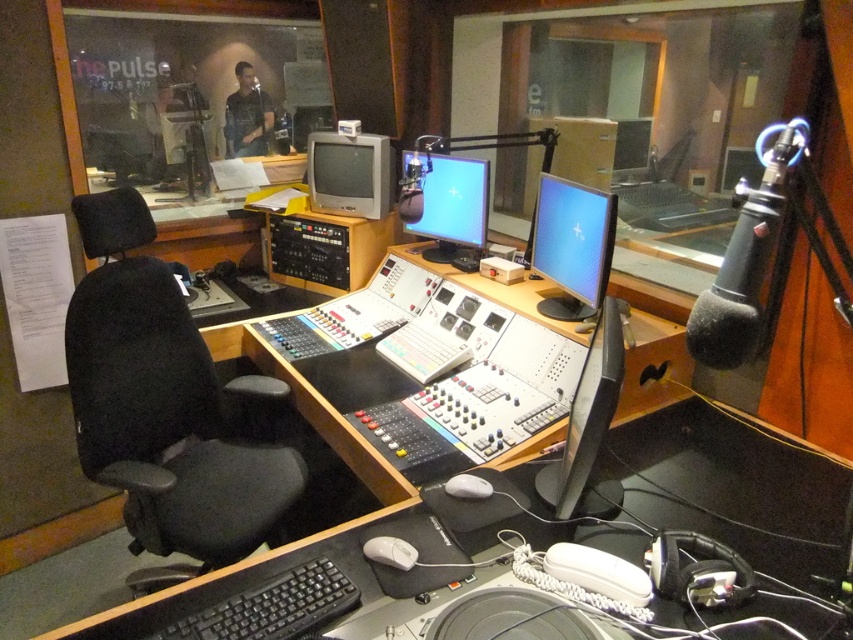
Who is more forward, (142, 433) or (303, 630)?

Positioned in front is point (303, 630).

Locate an element on the screen. Image resolution: width=853 pixels, height=640 pixels. black fabric swivel chair at left is located at coordinates (167, 424).

Which of these two, black plastic keyboard at lower left or black matte monitor at center, stands taller?

Standing taller between the two is black matte monitor at center.

Can you confirm if black plastic keyboard at lower left is smaller than black matte monitor at center?

Indeed, black plastic keyboard at lower left has a smaller size compared to black matte monitor at center.

This screenshot has width=853, height=640. What do you see at coordinates (273, 605) in the screenshot? I see `black plastic keyboard at lower left` at bounding box center [273, 605].

Locate an element on the screen. black plastic keyboard at lower left is located at coordinates [x=273, y=605].

Does matte gray crt monitor at center appear under white plastic mouse at lower center?

No.

The height and width of the screenshot is (640, 853). Find the location of `matte gray crt monitor at center`. matte gray crt monitor at center is located at coordinates pos(349,173).